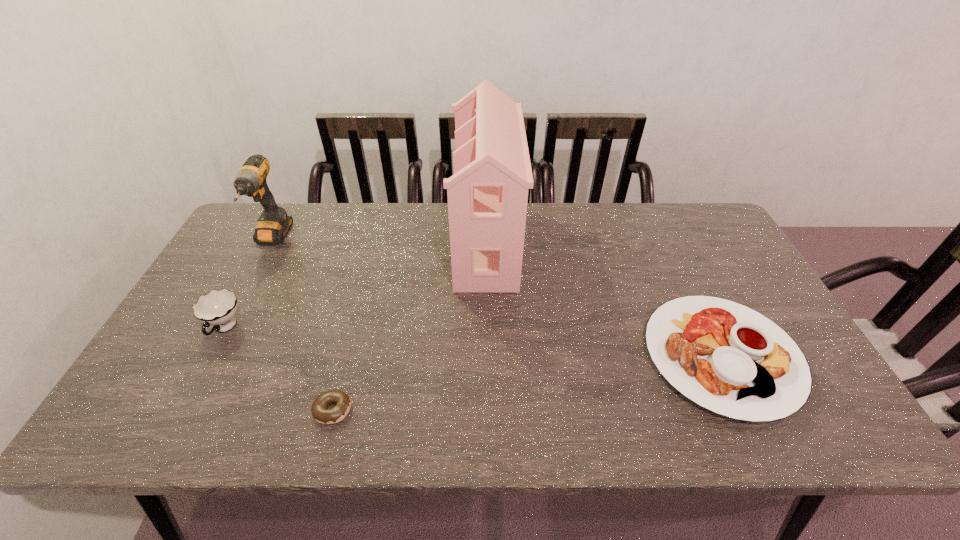
The width and height of the screenshot is (960, 540). I want to click on vacant region between the fourth shortest object and the third shortest object, so click(249, 284).

Find the location of a particular element. The image size is (960, 540). free area in between the third object from left to right and the dollhouse is located at coordinates (409, 327).

Identify the location of empty space between the doughnut and the second object from right to left. (409, 327).

Locate an element on the screen. This screenshot has height=540, width=960. vacant space that is in between the cup and the second tallest object is located at coordinates (249, 284).

The height and width of the screenshot is (540, 960). Identify the location of vacant area that lies between the second object from right to left and the drill. (379, 241).

This screenshot has width=960, height=540. In order to click on free space between the shortest object and the fourth shortest object in this screenshot , I will do `click(302, 324)`.

Where is `blank region between the rightmost object and the doughnut`? The image size is (960, 540). blank region between the rightmost object and the doughnut is located at coordinates (527, 383).

Locate an element on the screen. This screenshot has height=540, width=960. vacant area that lies between the drill and the fourth object from left to right is located at coordinates (379, 241).

The height and width of the screenshot is (540, 960). What are the coordinates of `object that is the closest to the platter` in the screenshot? It's located at (487, 196).

The height and width of the screenshot is (540, 960). In order to click on the third closest object to the shortest object in this screenshot , I will do `click(273, 224)`.